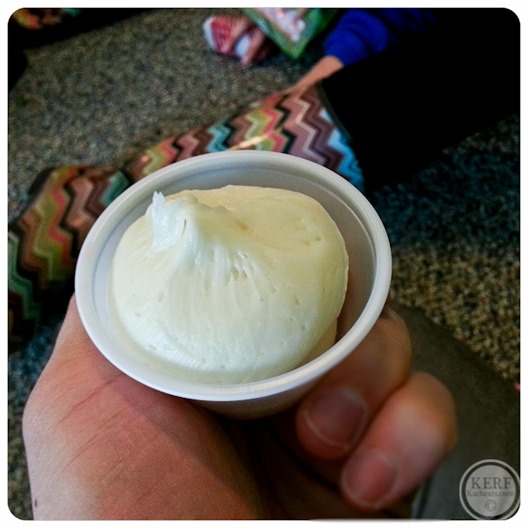
Locate an element on the screen. This screenshot has width=528, height=528. plastic cup is located at coordinates (380, 279).